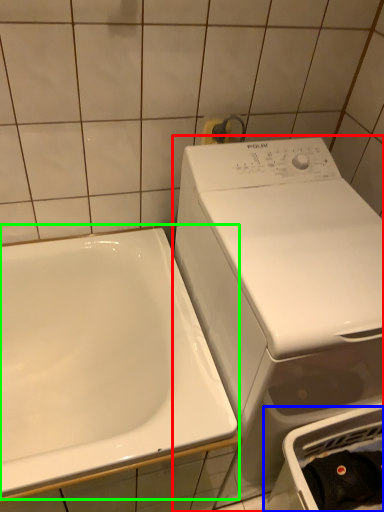
Question: Estimate the real-world distances between objects in this image. Which object is closer to washing machine (highlighted by a red box), dish washer (highlighted by a blue box) or sink (highlighted by a green box)?

Choices:
 (A) dish washer
 (B) sink

Answer: (A)